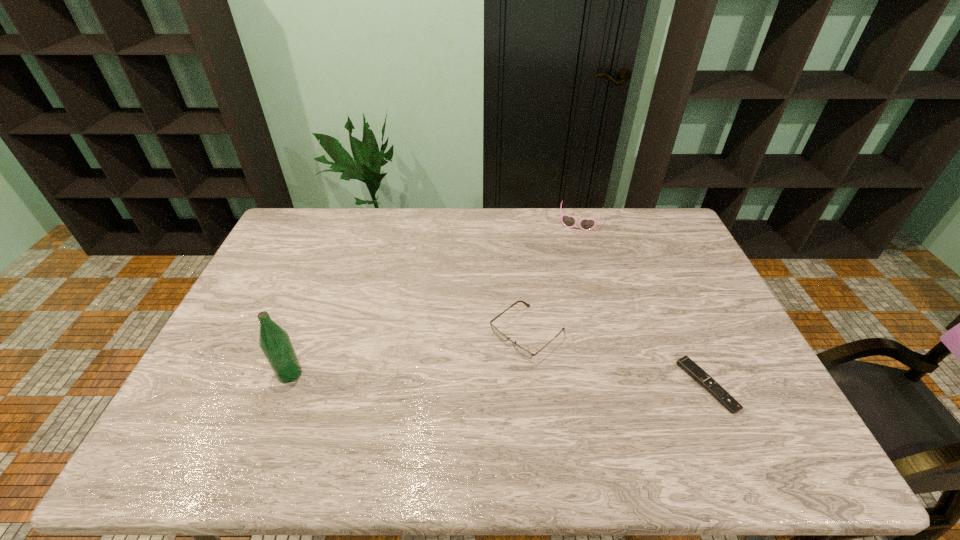
Where is `the leftmost object`? The image size is (960, 540). the leftmost object is located at coordinates (274, 341).

This screenshot has width=960, height=540. Find the location of `the tallest object`. the tallest object is located at coordinates (274, 341).

Where is `remote control`? This screenshot has height=540, width=960. remote control is located at coordinates (685, 363).

You are a GUI agent. You are given a task and a screenshot of the screen. Output one action in this format:
    pyautogui.click(x=<x>, y=<y>)
    Task: Click on the rightmost object
    This screenshot has height=540, width=960.
    Given the screenshot: What is the action you would take?
    pyautogui.click(x=685, y=363)

This screenshot has height=540, width=960. I want to click on the second tallest object, so click(585, 224).

Locate an element on the screen. the second object from right to left is located at coordinates (585, 224).

Find the location of a particular element. the third object from right to left is located at coordinates (524, 352).

The height and width of the screenshot is (540, 960). Identify the location of the second shortest object. (524, 352).

Identify the location of free space located on the right of the tallest object. (375, 374).

You are a GUI agent. You are given a task and a screenshot of the screen. Output one action in this format:
    pyautogui.click(x=<x>, y=<y>)
    Task: Click on the vacant area situated 0.090m on the left of the rightmost object
    This screenshot has height=540, width=960.
    Given the screenshot: What is the action you would take?
    pyautogui.click(x=650, y=386)